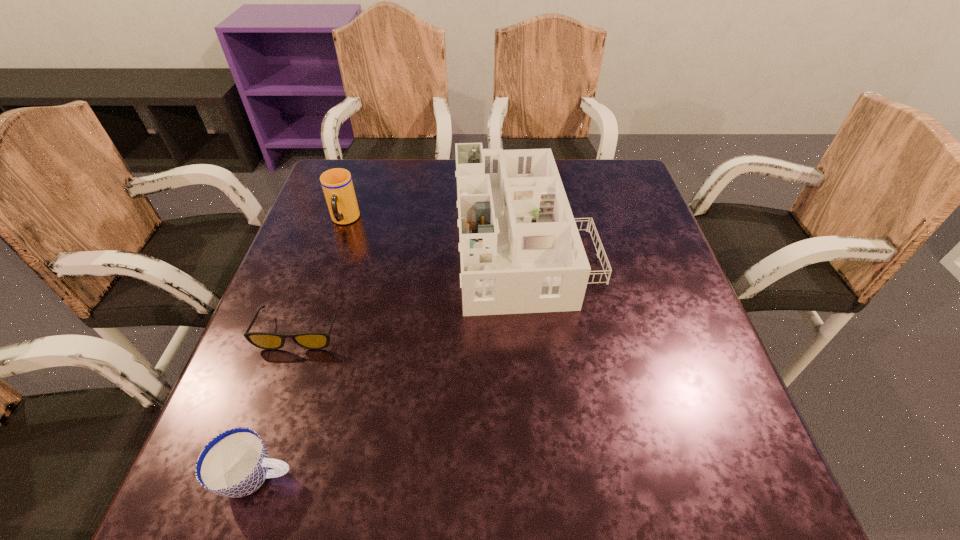
The width and height of the screenshot is (960, 540). What are the coordinates of `unoccupied position between the shorter cup and the sunglasses` in the screenshot? It's located at (278, 404).

What are the coordinates of `free spot between the farther cup and the rightmost object` in the screenshot? It's located at (434, 230).

Where is `free spot between the farther cup and the dollhouse`? This screenshot has width=960, height=540. free spot between the farther cup and the dollhouse is located at coordinates (434, 230).

What are the coordinates of `free space between the sunglasses and the nearer cup` in the screenshot? It's located at (278, 404).

The image size is (960, 540). Identify the location of free space between the rightmost object and the taller cup. (434, 230).

At what (x,y) coordinates should I click in order to perform the action: click on vacant space that's between the shortest object and the rightmost object. Please return your answer as a coordinate pair (x, y). The height and width of the screenshot is (540, 960). Looking at the image, I should click on (412, 285).

Where is `free space that is in between the dollhouse and the sunglasses`? free space that is in between the dollhouse and the sunglasses is located at coordinates (412, 285).

At what (x,y) coordinates should I click in order to perform the action: click on free space between the shorter cup and the farther cup. Please return your answer as a coordinate pair (x, y). The width and height of the screenshot is (960, 540). Looking at the image, I should click on (300, 348).

The width and height of the screenshot is (960, 540). I want to click on vacant region between the sunglasses and the farther cup, so click(x=323, y=276).

Choose which object is the third nearest neighbor to the third tallest object. Please provide its 2D coordinates. Your answer should be formatted as a tuple, i.e. [(x, y)], where the tuple contains the x and y coordinates of a point satisfying the conditions above.

[(337, 185)]